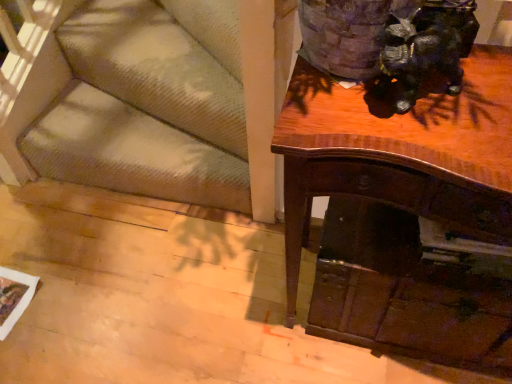
Question: Is shiny brown desk at upper right turned away from wooden drawer at lower right?

Choices:
 (A) no
 (B) yes

Answer: (B)

Question: Considering the relative sizes of shiny brown desk at upper right and wooden drawer at lower right in the image provided, is shiny brown desk at upper right wider than wooden drawer at lower right?

Choices:
 (A) no
 (B) yes

Answer: (A)

Question: Is shiny brown desk at upper right thinner than wooden drawer at lower right?

Choices:
 (A) no
 (B) yes

Answer: (B)

Question: Does shiny brown desk at upper right have a lesser height compared to wooden drawer at lower right?

Choices:
 (A) no
 (B) yes

Answer: (A)

Question: Is shiny brown desk at upper right outside wooden drawer at lower right?

Choices:
 (A) no
 (B) yes

Answer: (A)

Question: Does point (465, 327) appear closer or farther from the camera than point (452, 72)?

Choices:
 (A) farther
 (B) closer

Answer: (A)

Question: Choose the correct answer: Is shiny brown desk at upper right inside shiny black statue at upper right or outside it?

Choices:
 (A) outside
 (B) inside

Answer: (A)

Question: Considering the positions of shiny brown desk at upper right and shiny black statue at upper right in the image, is shiny brown desk at upper right bigger or smaller than shiny black statue at upper right?

Choices:
 (A) big
 (B) small

Answer: (A)

Question: Looking at their shapes, would you say shiny brown desk at upper right is wider or thinner than shiny black statue at upper right?

Choices:
 (A) thin
 (B) wide

Answer: (B)

Question: From a real-world perspective, is shiny brown desk at upper right above or below wooden drawer at lower right?

Choices:
 (A) below
 (B) above

Answer: (B)

Question: Looking at the image, does shiny brown desk at upper right seem bigger or smaller compared to wooden drawer at lower right?

Choices:
 (A) big
 (B) small

Answer: (A)

Question: From the image's perspective, is shiny brown desk at upper right positioned above or below wooden drawer at lower right?

Choices:
 (A) above
 (B) below

Answer: (A)

Question: Considering the positions of shiny brown desk at upper right and wooden drawer at lower right in the image, is shiny brown desk at upper right taller or shorter than wooden drawer at lower right?

Choices:
 (A) tall
 (B) short

Answer: (A)

Question: Would you say textured beige carpet at lower left is to the left or to the right of shiny black statue at upper right in the picture?

Choices:
 (A) left
 (B) right

Answer: (A)

Question: From their relative heights in the image, would you say textured beige carpet at lower left is taller or shorter than shiny black statue at upper right?

Choices:
 (A) tall
 (B) short

Answer: (A)